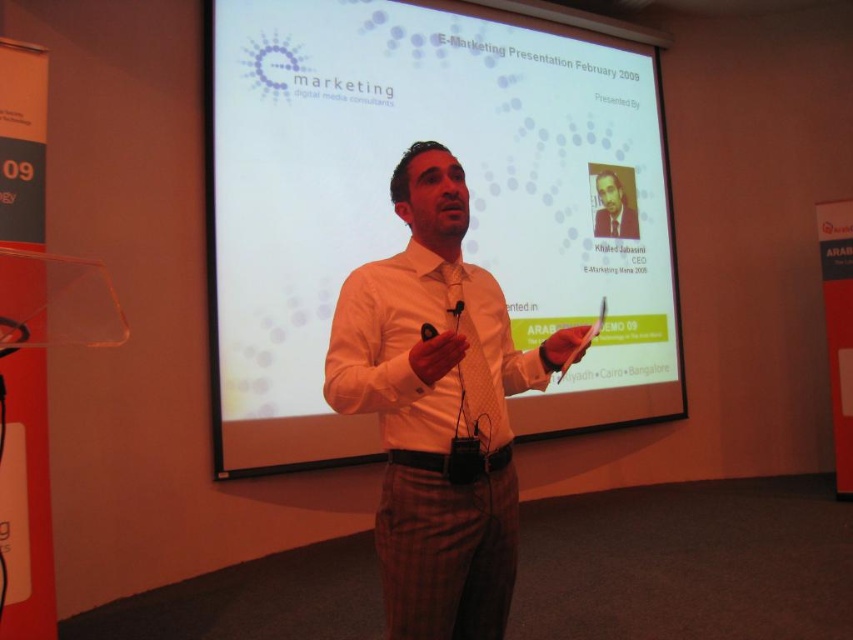
The height and width of the screenshot is (640, 853). What do you see at coordinates (438, 408) in the screenshot?
I see `white textured shirt at center` at bounding box center [438, 408].

What do you see at coordinates (438, 408) in the screenshot?
I see `white textured shirt at center` at bounding box center [438, 408].

Where is `white textured shirt at center`? white textured shirt at center is located at coordinates (438, 408).

Is white matte projection screen at center shorter than white textured shirt at center?

Incorrect, white matte projection screen at center's height does not fall short of white textured shirt at center's.

Is white matte projection screen at center below white textured shirt at center?

Actually, white matte projection screen at center is above white textured shirt at center.

Consider the image. Who is more forward, (549,237) or (485,380)?

Point (485,380) is more forward.

Find the location of a particular element. white matte projection screen at center is located at coordinates (402, 225).

Where is `white matte projection screen at center`? The width and height of the screenshot is (853, 640). white matte projection screen at center is located at coordinates (402, 225).

Does point (570, 401) come farther from viewer compared to point (601, 200)?

No, (570, 401) is in front of (601, 200).

The width and height of the screenshot is (853, 640). Find the location of `white matte projection screen at center`. white matte projection screen at center is located at coordinates (402, 225).